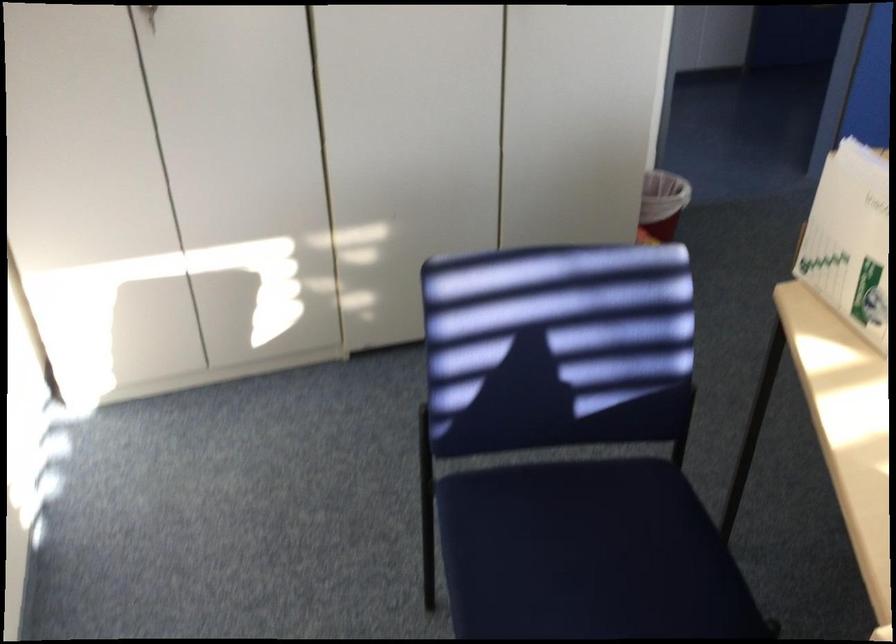
At what (x,y) coordinates should I click in order to perform the action: click on cabinet door lock. Please return your answer as a coordinate pair (x, y). The width and height of the screenshot is (896, 644). Looking at the image, I should click on point(149,15).